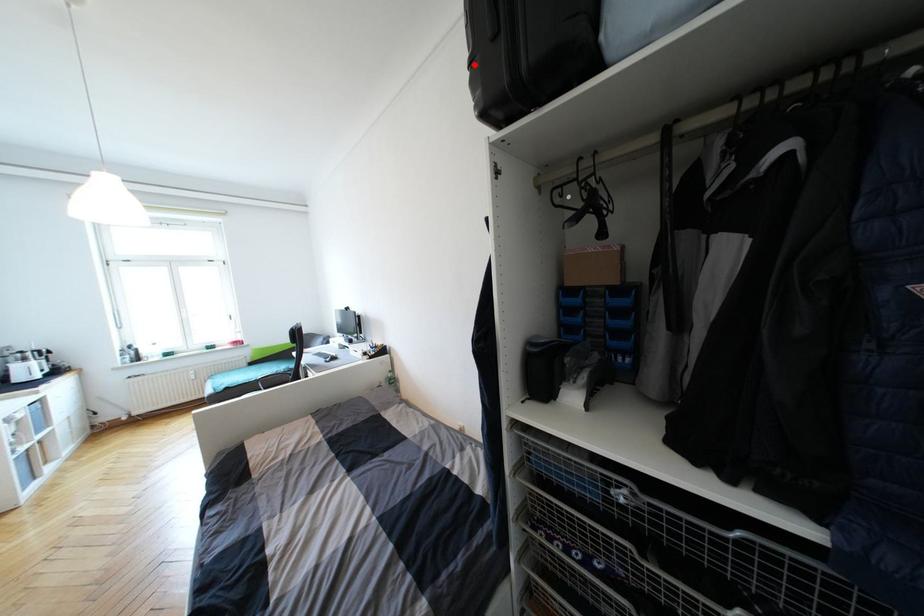
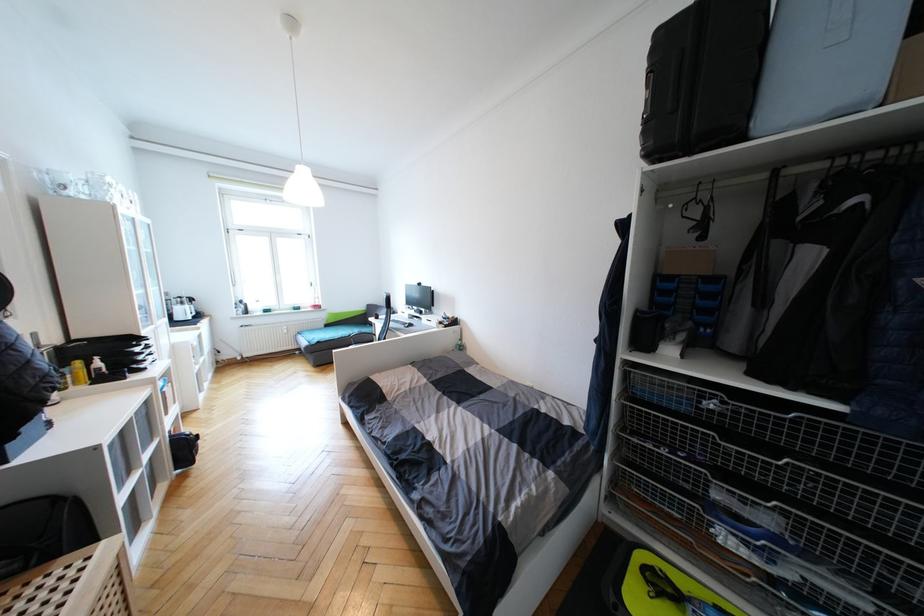
In the second image, find the point that corresponds to the highlighted location in the first image.

(649, 123)